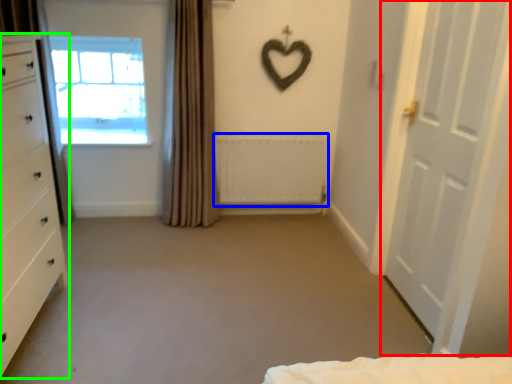
Question: Based on their relative distances, which object is farther from door (highlighted by a red box)? Choose from radiator (highlighted by a blue box) and chest of drawers (highlighted by a green box).

Choices:
 (A) radiator
 (B) chest of drawers

Answer: (B)